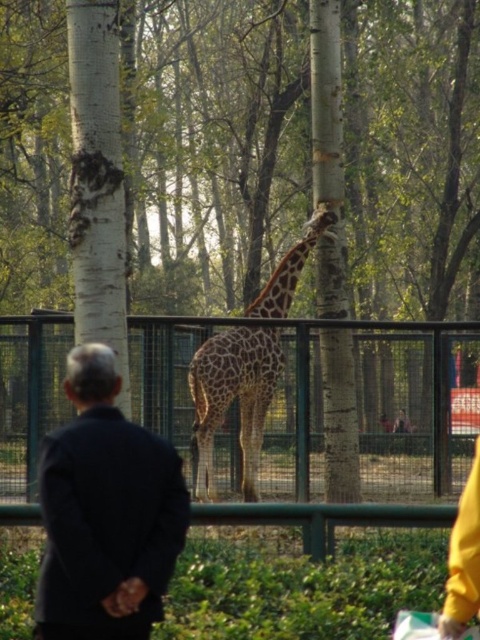
Question: Among these objects, which one is farthest from the camera?

Choices:
 (A) dark blue suit at center
 (B) spotted fur giraffe at center

Answer: (B)

Question: Which object is the farthest from the green metal fence at center?

Choices:
 (A) dark blue suit at center
 (B) spotted fur giraffe at center

Answer: (A)

Question: Is green metal fence at center to the right of spotted fur giraffe at center from the viewer's perspective?

Choices:
 (A) yes
 (B) no

Answer: (A)

Question: Can you confirm if green metal fence at center is thinner than spotted fur giraffe at center?

Choices:
 (A) yes
 (B) no

Answer: (B)

Question: Which point is closer to the camera?

Choices:
 (A) (372, 499)
 (B) (255, 381)

Answer: (B)

Question: From the image, what is the correct spatial relationship of green metal fence at center in relation to dark blue suit at center?

Choices:
 (A) right
 (B) left

Answer: (A)